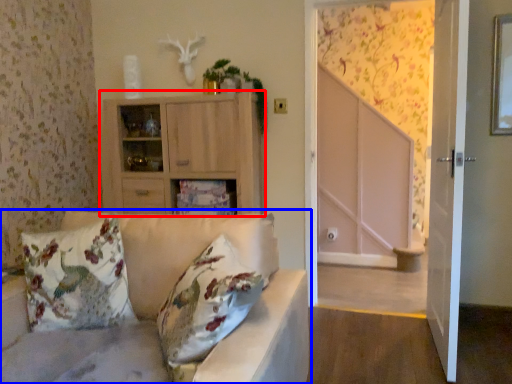
Question: Which object appears farthest to the camera in this image, cabinetry (highlighted by a red box) or studio couch (highlighted by a blue box)?

Choices:
 (A) cabinetry
 (B) studio couch

Answer: (A)